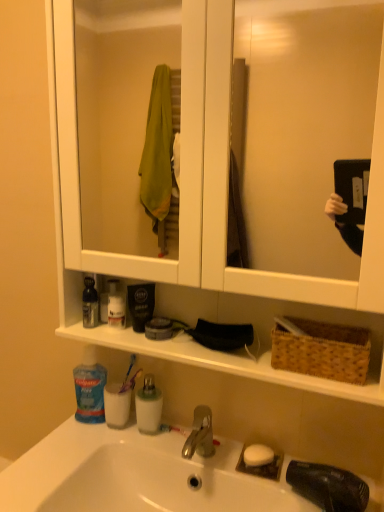
Describe the element at coordinates (258, 455) in the screenshot. The height and width of the screenshot is (512, 384). I see `white matte soap at center` at that location.

Image resolution: width=384 pixels, height=512 pixels. Describe the element at coordinates (90, 303) in the screenshot. I see `transparent plastic bottle at shelf left` at that location.

Identify the location of blue plastic toothpaste at lower left. (90, 388).

What do you see at coordinates (90, 388) in the screenshot? I see `blue plastic toothpaste at lower left` at bounding box center [90, 388].

Describe the element at coordinates (322, 351) in the screenshot. I see `brown woven basket at right` at that location.

The width and height of the screenshot is (384, 512). I want to click on brown woven basket at right, so click(322, 351).

Image resolution: width=384 pixels, height=512 pixels. Identify the location of purple plastic toothbrush at lower center. tap(130, 367).

I want to click on white glossy sink at lower center, so click(x=135, y=475).

Locate an element on the screen. This screenshot has width=384, height=512. white matte soap at center is located at coordinates (258, 455).

Is point (89, 327) farther from camera compared to point (55, 454)?

Yes, it is behind point (55, 454).

Would you say transparent plastic bottle at shelf left is inside or outside white glossy sink at lower center?

The correct answer is: outside.

Considering the relative positions of transparent plastic bottle at shelf left and white glossy sink at lower center in the image provided, is transparent plastic bottle at shelf left to the right of white glossy sink at lower center from the viewer's perspective?

No, transparent plastic bottle at shelf left is not to the right of white glossy sink at lower center.

Which object is closer to the camera, brown woven basket at right or white opaque cup at lower left, acting as the 2th mouthwash starting from the top?

→ brown woven basket at right is in front.

Is brown woven basket at right not near white opaque cup at lower left, the first mouthwash from the bottom?

They are positioned close to each other.

Considering the sizes of objects brown woven basket at right and white opaque cup at lower left, the first mouthwash from the bottom, in the image provided, who is wider, brown woven basket at right or white opaque cup at lower left, the first mouthwash from the bottom,?

brown woven basket at right.

This screenshot has height=512, width=384. I want to click on picnic basket above the white opaque cup at lower left, acting as the 2th mouthwash starting from the top (from a real-world perspective), so click(322, 351).

From a real-world perspective, is white matte soap at center physically above brown woven basket at right?

No, from a real-world perspective, white matte soap at center is not above brown woven basket at right.

Consider the image. From the image's perspective, is white matte soap at center below brown woven basket at right?

Indeed, from the image's perspective, white matte soap at center is shown beneath brown woven basket at right.

Is white matte soap at center facing away from brown woven basket at right?

No, white matte soap at center is not facing the opposite direction of brown woven basket at right.

Considering the sizes of objects white matte soap at center and brown woven basket at right in the image provided, who is bigger, white matte soap at center or brown woven basket at right?

brown woven basket at right is bigger.

Where is `picnic basket that is in front of the white opaque cup at lower left, the first mouthwash from the bottom`? This screenshot has width=384, height=512. picnic basket that is in front of the white opaque cup at lower left, the first mouthwash from the bottom is located at coordinates (322, 351).

Based on the photo, how many degrees apart are the facing directions of white opaque cup at lower left, acting as the 2th mouthwash starting from the top, and brown woven basket at right?

They differ by 0.489 degrees in their facing directions.

From their relative heights in the image, would you say white opaque cup at lower left, the first mouthwash from the bottom, is taller or shorter than brown woven basket at right?

white opaque cup at lower left, the first mouthwash from the bottom, is taller than brown woven basket at right.

From the image's perspective, which is below, white opaque cup at lower left, the first mouthwash from the bottom, or brown woven basket at right?

white opaque cup at lower left, the first mouthwash from the bottom, appears lower in the image.

Considering the sizes of purple plastic toothbrush at lower center and brown woven basket at right in the image, is purple plastic toothbrush at lower center wider or thinner than brown woven basket at right?

Considering their sizes, purple plastic toothbrush at lower center looks slimmer than brown woven basket at right.

Is purple plastic toothbrush at lower center positioned before brown woven basket at right?

No, it is behind brown woven basket at right.

From a real-world perspective, is purple plastic toothbrush at lower center physically located above or below brown woven basket at right?

purple plastic toothbrush at lower center is situated lower than brown woven basket at right in the real world.

In terms of height, does purple plastic toothbrush at lower center look taller or shorter compared to brown woven basket at right?

Clearly, purple plastic toothbrush at lower center is taller compared to brown woven basket at right.

Are transparent plastic bottle at shelf left and blue plastic toothpaste at lower left making contact?

transparent plastic bottle at shelf left and blue plastic toothpaste at lower left are clearly separated.

Which of these two, transparent plastic bottle at shelf left or blue plastic toothpaste at lower left, is smaller?

Smaller between the two is transparent plastic bottle at shelf left.

You are a GUI agent. You are given a task and a screenshot of the screen. Output one action in this format:
    pyautogui.click(x=<x>, y=<y>)
    Task: Click on the toiletry behind the transparent plastic bottle at shelf left
    This screenshot has height=512, width=384.
    Given the screenshot: What is the action you would take?
    (90, 388)

Considering the sizes of objects transparent plastic bottle at shelf left and blue plastic toothpaste at lower left in the image provided, who is wider, transparent plastic bottle at shelf left or blue plastic toothpaste at lower left?

Wider between the two is blue plastic toothpaste at lower left.

Can we say transparent plastic bottle at shelf left lies outside brown woven basket at right?

Yes, transparent plastic bottle at shelf left is outside of brown woven basket at right.

Which is farther, (86, 289) or (350, 360)?

The point (86, 289) is more distant.

Does transparent plastic bottle at shelf left lie behind brown woven basket at right?

That is True.

Considering the relative sizes of transparent plastic bottle at shelf left and brown woven basket at right in the image provided, is transparent plastic bottle at shelf left shorter than brown woven basket at right?

Incorrect, the height of transparent plastic bottle at shelf left does not fall short of that of brown woven basket at right.

Find the location of a particular element. This screenshot has width=384, height=512. bottle above the white glossy sink at lower center (from the image's perspective) is located at coordinates (90, 303).

Starting from the brown woven basket at right, which mouthwash is the 2nd one behind? Please provide its 2D coordinates.

[(117, 405)]

When comparing their distances from blue translucent mouthwash at center, marked as the 2th mouthwash in a bottom-to-top arrangement, does purple plastic toothbrush at lower center or clear plastic container at center seem further?

The object further to blue translucent mouthwash at center, marked as the 2th mouthwash in a bottom-to-top arrangement, is clear plastic container at center.

Based on their spatial positions, is blue plastic toothpaste at lower left or white opaque cup at lower left, acting as the 2th mouthwash starting from the top, further from transparent plastic bottle at shelf left?

The object further to transparent plastic bottle at shelf left is white opaque cup at lower left, acting as the 2th mouthwash starting from the top.

Based on their spatial positions, is blue plastic toothpaste at lower left or clear plastic container at center closer to white matte soap at center?

clear plastic container at center is positioned closer to the anchor white matte soap at center.

Based on their spatial positions, is clear plastic container at center or blue plastic toothpaste at lower left further from white opaque cup at lower left, the first mouthwash from the bottom?

clear plastic container at center is further to white opaque cup at lower left, the first mouthwash from the bottom.

Estimate the real-world distances between objects in this image. Which object is closer to white matte soap at center, transparent plastic bottle at shelf left or blue plastic toothpaste at lower left?

Based on the image, blue plastic toothpaste at lower left appears to be nearer to white matte soap at center.

Estimate the real-world distances between objects in this image. Which object is closer to transparent plastic bottle at shelf left, blue translucent mouthwash at center, acting as the 1th mouthwash starting from the top, or clear plastic container at center?

Among the two, blue translucent mouthwash at center, acting as the 1th mouthwash starting from the top, is located nearer to transparent plastic bottle at shelf left.

Estimate the real-world distances between objects in this image. Which object is closer to blue translucent mouthwash at center, marked as the 2th mouthwash in a bottom-to-top arrangement, blue plastic toothpaste at lower left or white opaque cup at lower left, acting as the 2th mouthwash starting from the top?

blue plastic toothpaste at lower left.

Which object lies nearer to the anchor point clear plastic container at center, white matte soap at center or white opaque cup at lower left, the first mouthwash from the bottom?

white opaque cup at lower left, the first mouthwash from the bottom.

What are the coordinates of `bottle between blue translucent mouthwash at center, acting as the 1th mouthwash starting from the top, and white opaque cup at lower left, the first mouthwash from the bottom, in the up-down direction` in the screenshot? It's located at (90, 303).

I want to click on toothbrush between transparent plastic bottle at shelf left and clear plastic container at center in the vertical direction, so click(130, 367).

This screenshot has height=512, width=384. In order to click on toiletry between transparent plastic bottle at shelf left and white opaque cup at lower left, acting as the 2th mouthwash starting from the top, in the up-down direction in this screenshot , I will do `click(90, 388)`.

Locate an element on the screen. picnic basket that lies between blue translucent mouthwash at center, marked as the 2th mouthwash in a bottom-to-top arrangement, and white glossy sink at lower center from top to bottom is located at coordinates [322, 351].